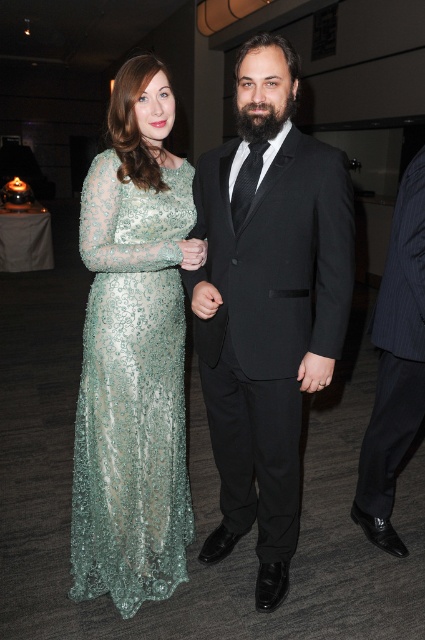
Who is lower down, black satin suit at center or green sequined dress at left?

green sequined dress at left is below.

Does black satin suit at center appear under green sequined dress at left?

No, black satin suit at center is not below green sequined dress at left.

Who is more distant from viewer, (285, 180) or (153, 552)?

The point (153, 552) is more distant.

Where is `black satin suit at center`? The width and height of the screenshot is (425, 640). black satin suit at center is located at coordinates coord(266,304).

Looking at this image, is green sequined dress at left bigger than pinstriped fabric suit at right?

Yes.

Does green sequined dress at left come in front of pinstriped fabric suit at right?

Yes, green sequined dress at left is in front of pinstriped fabric suit at right.

Is point (127, 260) more distant than point (402, 195)?

No, (127, 260) is closer to viewer.

Find the location of a particular element. green sequined dress at left is located at coordinates (132, 392).

Who is shorter, black satin suit at center or pinstriped fabric suit at right?

With less height is pinstriped fabric suit at right.

Does black satin suit at center have a lesser width compared to pinstriped fabric suit at right?

Incorrect, black satin suit at center's width is not less than pinstriped fabric suit at right's.

This screenshot has height=640, width=425. Find the location of `black satin suit at center`. black satin suit at center is located at coordinates (266, 304).